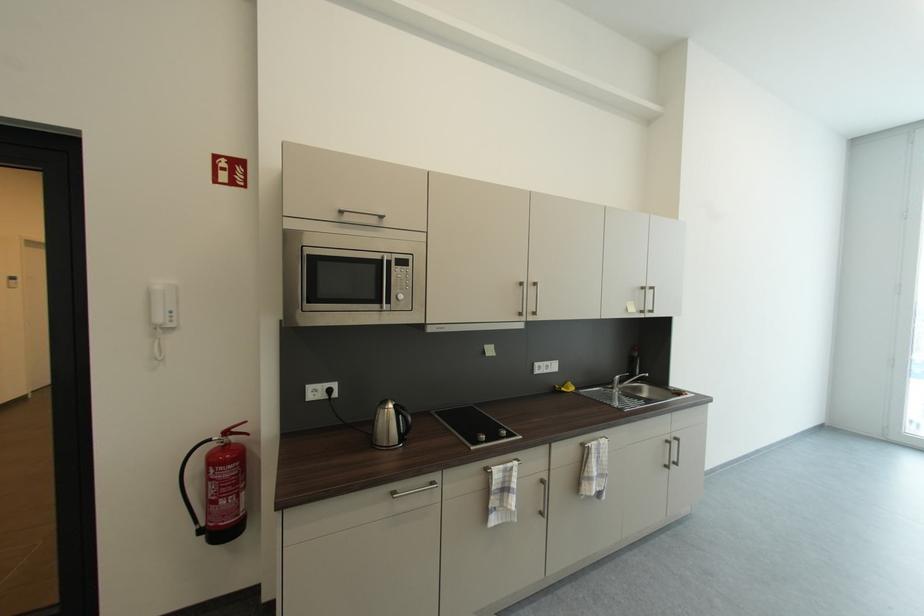
The height and width of the screenshot is (616, 924). I want to click on silver microwave dial, so click(402, 286).